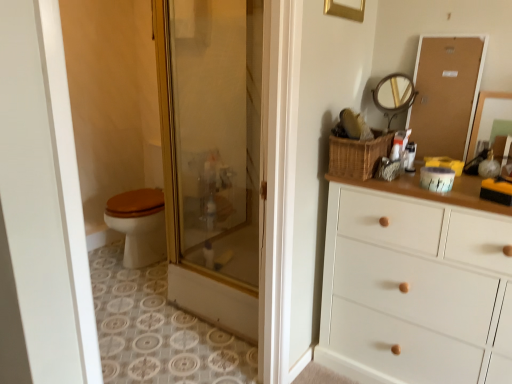
Identify the location of gold-toned metal mirror at upper right, which ranks as the first mirror in left-to-right order. (394, 95).

This screenshot has height=384, width=512. What do you see at coordinates (416, 284) in the screenshot?
I see `white painted wood chest of drawers at right` at bounding box center [416, 284].

The width and height of the screenshot is (512, 384). What are the coordinates of `white painted wood chest of drawers at right` in the screenshot? It's located at (416, 284).

You are a GUI agent. You are given a task and a screenshot of the screen. Output one action in this format:
    pyautogui.click(x=<x>, y=<y>)
    Task: Click on the matte wooden mirror at upper right, positioned as the first mirror in right-to-left order
    The image size is (512, 384).
    Given the screenshot: What is the action you would take?
    pyautogui.click(x=481, y=116)

Which of these two, matte wooden mirror at upper right, which is the second mirror from left to right, or gold-toned metal mirror at upper right, which ranks as the first mirror in left-to-right order, is bigger?

With larger size is matte wooden mirror at upper right, which is the second mirror from left to right.

Is point (477, 134) in front of point (391, 104)?

That is True.

Identify the location of mirror that is above the matte wooden mirror at upper right, which is the second mirror from left to right (from a real-world perspective). This screenshot has height=384, width=512. (394, 95).

From their relative heights in the image, would you say gold-toned metal mirror at upper right, which ranks as the first mirror in left-to-right order, is taller or shorter than matte wooden mirror at upper right, positioned as the first mirror in right-to-left order?

In the image, gold-toned metal mirror at upper right, which ranks as the first mirror in left-to-right order, appears to be taller than matte wooden mirror at upper right, positioned as the first mirror in right-to-left order.

Considering the relative sizes of gold-toned metal mirror at upper right, which ranks as the first mirror in left-to-right order, and matte wooden mirror at upper right, positioned as the first mirror in right-to-left order, in the image provided, is gold-toned metal mirror at upper right, which ranks as the first mirror in left-to-right order, smaller than matte wooden mirror at upper right, positioned as the first mirror in right-to-left order,?

Yes.

From the image's perspective, is gold-toned metal mirror at upper right, which ranks as the first mirror in left-to-right order, on matte wooden mirror at upper right, positioned as the first mirror in right-to-left order?

Correct, gold-toned metal mirror at upper right, which ranks as the first mirror in left-to-right order, appears higher than matte wooden mirror at upper right, positioned as the first mirror in right-to-left order, in the image.

Is matte wooden mirror at upper right, which is the second mirror from left to right, at the back of gold-toned metal mirror at upper right, which ranks as the first mirror in left-to-right order?

No.

Is point (377, 103) positioned after point (360, 186)?

Yes, point (377, 103) is behind point (360, 186).

From a real-world perspective, between gold-toned metal mirror at upper right, which ranks as the 2th mirror in right-to-left order, and white painted wood chest of drawers at right, who is vertically lower?

From a 3D spatial view, white painted wood chest of drawers at right is below.

From the image's perspective, between gold-toned metal mirror at upper right, which ranks as the 2th mirror in right-to-left order, and white painted wood chest of drawers at right, which one is located above?

gold-toned metal mirror at upper right, which ranks as the 2th mirror in right-to-left order, is shown above in the image.

How many degrees apart are the facing directions of gold-toned metal mirror at upper right, which ranks as the first mirror in left-to-right order, and white painted wood chest of drawers at right?

gold-toned metal mirror at upper right, which ranks as the first mirror in left-to-right order, and white painted wood chest of drawers at right are facing 1.41 degrees away from each other.

Based on their positions, is woven brown basket at upper right located to the left or right of matte wooden mirror at upper right, which is the second mirror from left to right?

Clearly, woven brown basket at upper right is on the left of matte wooden mirror at upper right, which is the second mirror from left to right, in the image.

From a real-world perspective, which object rests below the other?

From a 3D spatial view, woven brown basket at upper right is below.

Is woven brown basket at upper right far from matte wooden mirror at upper right, positioned as the first mirror in right-to-left order?

No, woven brown basket at upper right is not far from matte wooden mirror at upper right, positioned as the first mirror in right-to-left order.

Is woven brown basket at upper right inside or outside of corkboard at upper right?

woven brown basket at upper right is outside corkboard at upper right.

Consider the image. In the image, is woven brown basket at upper right positioned in front of or behind corkboard at upper right?

woven brown basket at upper right is positioned closer to the viewer than corkboard at upper right.

In the image, is woven brown basket at upper right on the left side or the right side of corkboard at upper right?

woven brown basket at upper right is positioned on corkboard at upper right's left side.

From a real-world perspective, which is physically below, woven brown basket at upper right or corkboard at upper right?

woven brown basket at upper right.

Between white painted wood chest of drawers at right and woven brown basket at upper right, which one has smaller width?

woven brown basket at upper right is thinner.

In the scene shown: Does white painted wood chest of drawers at right have a lesser height compared to woven brown basket at upper right?

No, white painted wood chest of drawers at right is not shorter than woven brown basket at upper right.

Is the depth of white painted wood chest of drawers at right greater than that of woven brown basket at upper right?

No, white painted wood chest of drawers at right is in front of woven brown basket at upper right.

Could you tell me if white painted wood chest of drawers at right is facing woven brown basket at upper right?

No, white painted wood chest of drawers at right is not turned towards woven brown basket at upper right.

Is gold-toned metal mirror at upper right, which ranks as the 2th mirror in right-to-left order, turned away from woven brown basket at upper right?

No, gold-toned metal mirror at upper right, which ranks as the 2th mirror in right-to-left order, is not facing away from woven brown basket at upper right.

From the image's perspective, which is above, gold-toned metal mirror at upper right, which ranks as the first mirror in left-to-right order, or woven brown basket at upper right?

gold-toned metal mirror at upper right, which ranks as the first mirror in left-to-right order, appears higher in the image.

Who is smaller, gold-toned metal mirror at upper right, which ranks as the first mirror in left-to-right order, or woven brown basket at upper right?

gold-toned metal mirror at upper right, which ranks as the first mirror in left-to-right order, is smaller.

From a real-world perspective, is gold-toned metal mirror at upper right, which ranks as the first mirror in left-to-right order, under woven brown basket at upper right?

Actually, gold-toned metal mirror at upper right, which ranks as the first mirror in left-to-right order, is physically above woven brown basket at upper right in the real world.

Where is `mirror located on the right of gold-toned metal mirror at upper right, which ranks as the 2th mirror in right-to-left order`? mirror located on the right of gold-toned metal mirror at upper right, which ranks as the 2th mirror in right-to-left order is located at coordinates (481, 116).

Locate an element on the screen. The width and height of the screenshot is (512, 384). mirror on the left of matte wooden mirror at upper right, which is the second mirror from left to right is located at coordinates (394, 95).

Based on their spatial positions, is white painted wood chest of drawers at right or woven brown basket at upper right closer to matte wooden mirror at upper right, positioned as the first mirror in right-to-left order?

The object closer to matte wooden mirror at upper right, positioned as the first mirror in right-to-left order, is woven brown basket at upper right.

From the image, which object appears to be farther from corkboard at upper right, white painted wood chest of drawers at right or matte wooden mirror at upper right, which is the second mirror from left to right?

Based on the image, white painted wood chest of drawers at right appears to be further to corkboard at upper right.

Estimate the real-world distances between objects in this image. Which object is closer to matte wooden mirror at upper right, which is the second mirror from left to right, corkboard at upper right or woven brown basket at upper right?

Based on the image, corkboard at upper right appears to be nearer to matte wooden mirror at upper right, which is the second mirror from left to right.

Estimate the real-world distances between objects in this image. Which object is closer to woven brown basket at upper right, corkboard at upper right or matte wooden mirror at upper right, which is the second mirror from left to right?

Among the two, corkboard at upper right is located nearer to woven brown basket at upper right.

From the image, which object appears to be farther from gold-toned metal mirror at upper right, which ranks as the 2th mirror in right-to-left order, matte wooden mirror at upper right, which is the second mirror from left to right, or woven brown basket at upper right?

woven brown basket at upper right is positioned further to the anchor gold-toned metal mirror at upper right, which ranks as the 2th mirror in right-to-left order.

Which object lies nearer to the anchor point white painted wood chest of drawers at right, gold-toned metal mirror at upper right, which ranks as the 2th mirror in right-to-left order, or matte wooden mirror at upper right, positioned as the first mirror in right-to-left order?

matte wooden mirror at upper right, positioned as the first mirror in right-to-left order, lies closer to white painted wood chest of drawers at right than the other object.

From the image, which object appears to be farther from white painted wood chest of drawers at right, corkboard at upper right or woven brown basket at upper right?

Based on the image, corkboard at upper right appears to be further to white painted wood chest of drawers at right.

From the image, which object appears to be farther from corkboard at upper right, matte wooden mirror at upper right, positioned as the first mirror in right-to-left order, or gold-toned metal mirror at upper right, which ranks as the first mirror in left-to-right order?

gold-toned metal mirror at upper right, which ranks as the first mirror in left-to-right order, is further to corkboard at upper right.

Locate an element on the screen. The image size is (512, 384). basket between corkboard at upper right and white painted wood chest of drawers at right vertically is located at coordinates (358, 155).

This screenshot has width=512, height=384. What are the coordinates of `mirror between woven brown basket at upper right and matte wooden mirror at upper right, positioned as the first mirror in right-to-left order, in the horizontal direction` in the screenshot? It's located at (394, 95).

Find the location of `basket between gold-toned metal mirror at upper right, which ranks as the 2th mirror in right-to-left order, and white painted wood chest of drawers at right in the up-down direction`. basket between gold-toned metal mirror at upper right, which ranks as the 2th mirror in right-to-left order, and white painted wood chest of drawers at right in the up-down direction is located at coordinates (358, 155).

The image size is (512, 384). Find the location of `mirror between gold-toned metal mirror at upper right, which ranks as the 2th mirror in right-to-left order, and white painted wood chest of drawers at right vertically`. mirror between gold-toned metal mirror at upper right, which ranks as the 2th mirror in right-to-left order, and white painted wood chest of drawers at right vertically is located at coordinates (481, 116).